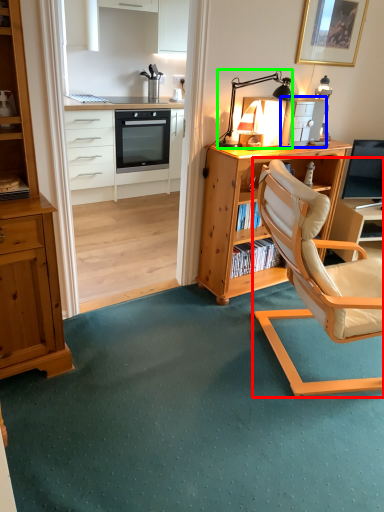
Question: Which object is the farthest from chair (highlighted by a red box)? Choose among these: appliance (highlighted by a blue box) or table lamp (highlighted by a green box).

Choices:
 (A) appliance
 (B) table lamp

Answer: (B)